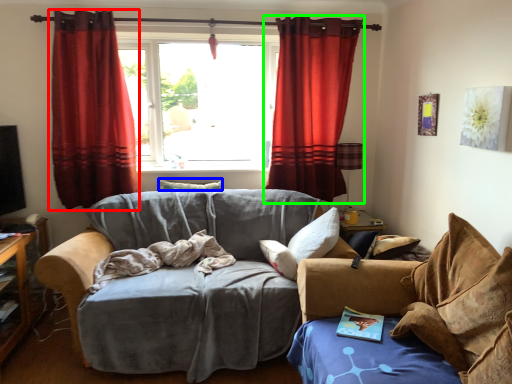
Question: Based on their relative distances, which object is farther from curtain (highlighted by a red box)? Choose from pillow (highlighted by a blue box) and curtain (highlighted by a green box).

Choices:
 (A) pillow
 (B) curtain

Answer: (B)